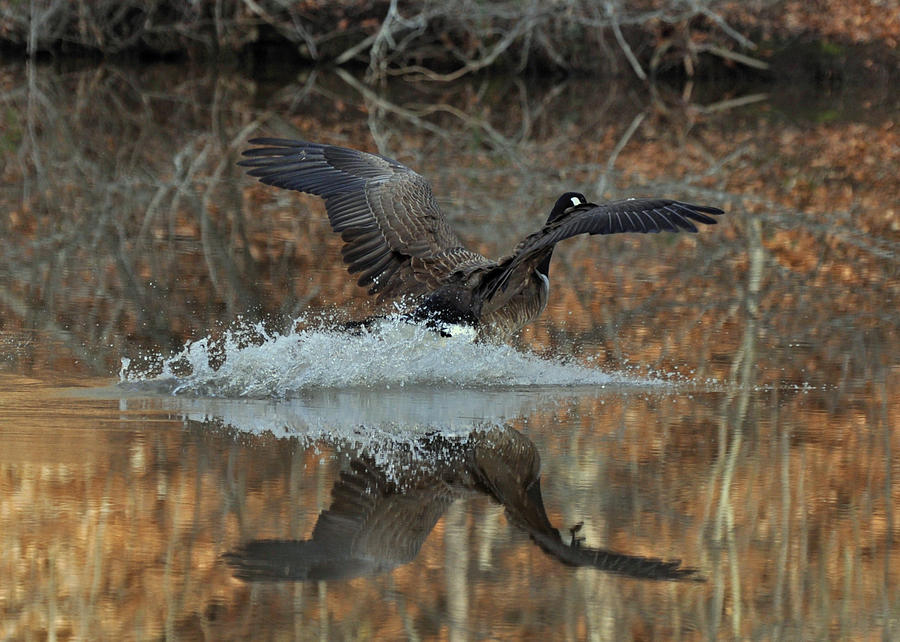
Identify the location of chest. (538, 296).